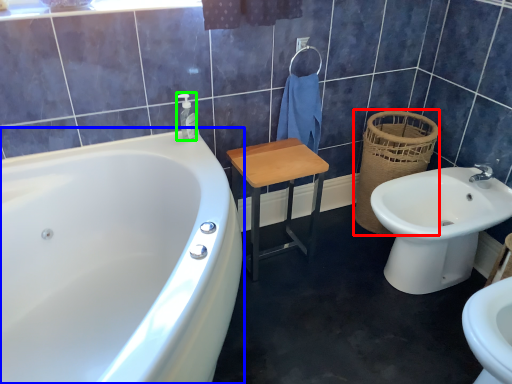
Question: Estimate the real-world distances between objects in this image. Which object is farther from basket (highlighted by a red box), bathtub (highlighted by a blue box) or soap dispenser (highlighted by a green box)?

Choices:
 (A) bathtub
 (B) soap dispenser

Answer: (A)